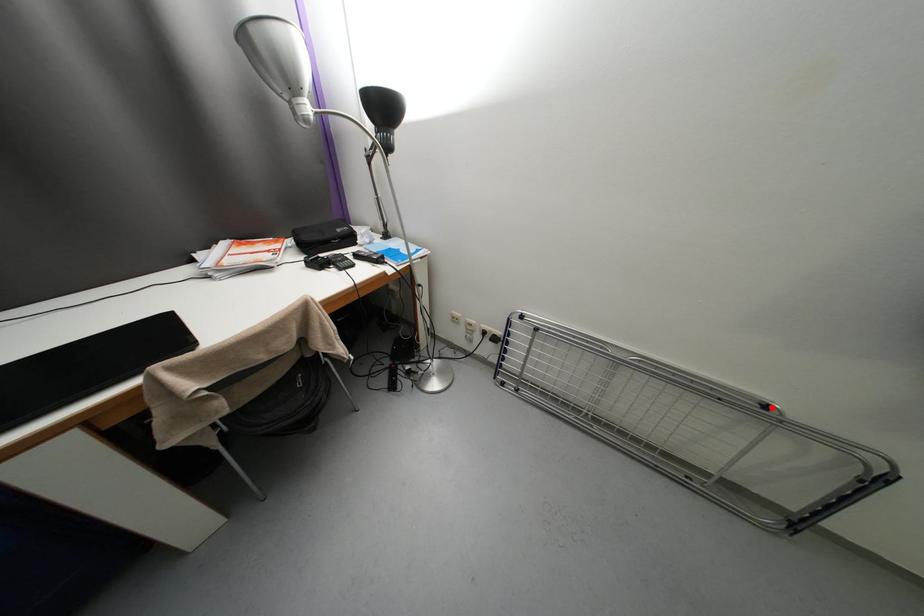
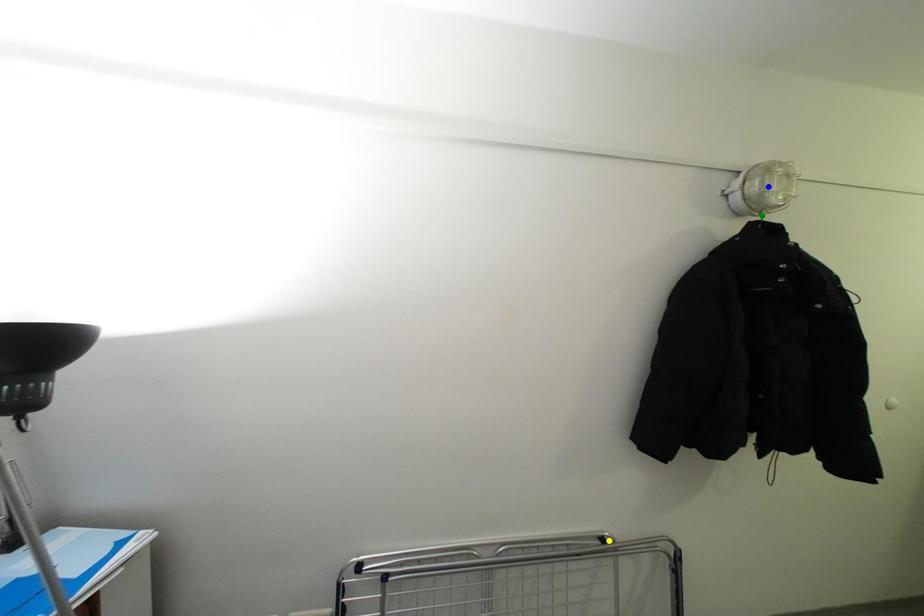
Question: I am providing you with two images of the same scene from different viewpoints. A red point is marked on the first image. You are given multiple points on the second image. Which point in image 2 is actually the same real-world point as the red point in image 1?

Choices:
 (A) blue point
 (B) green point
 (C) yellow point

Answer: (C)